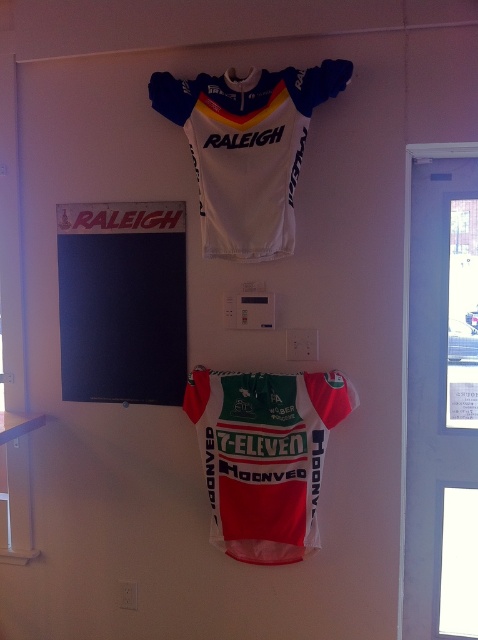
Is red/white/green jersey at center bigger than white matte jersey at upper center?

No, red/white/green jersey at center is not bigger than white matte jersey at upper center.

Can you confirm if red/white/green jersey at center is positioned to the right of white matte jersey at upper center?

Indeed, red/white/green jersey at center is positioned on the right side of white matte jersey at upper center.

Is point (197, 426) positioned before point (284, 86)?

No.

You are a GUI agent. You are given a task and a screenshot of the screen. Output one action in this format:
    pyautogui.click(x=<x>, y=<y>)
    Task: Click on the red/white/green jersey at center
    The width and height of the screenshot is (478, 640).
    Given the screenshot: What is the action you would take?
    pyautogui.click(x=264, y=456)

Can you confirm if black matte poster at upper center is wider than white matte jersey at upper center?

In fact, black matte poster at upper center might be narrower than white matte jersey at upper center.

Find the location of a particular element. The height and width of the screenshot is (640, 478). black matte poster at upper center is located at coordinates (122, 301).

Measure the distance between black matte poster at upper center and red/white/green jersey at center.

A distance of 17.81 inches exists between black matte poster at upper center and red/white/green jersey at center.

Where is `black matte poster at upper center`? This screenshot has height=640, width=478. black matte poster at upper center is located at coordinates (122, 301).

Where is `black matte poster at upper center`? Image resolution: width=478 pixels, height=640 pixels. black matte poster at upper center is located at coordinates (122, 301).